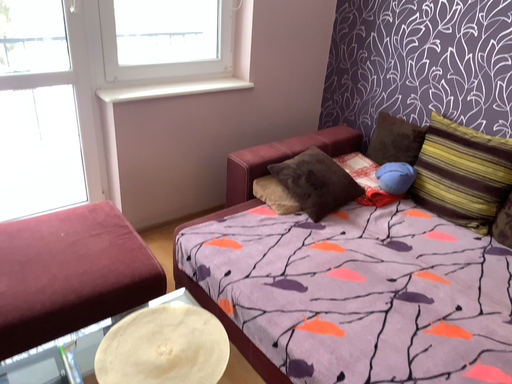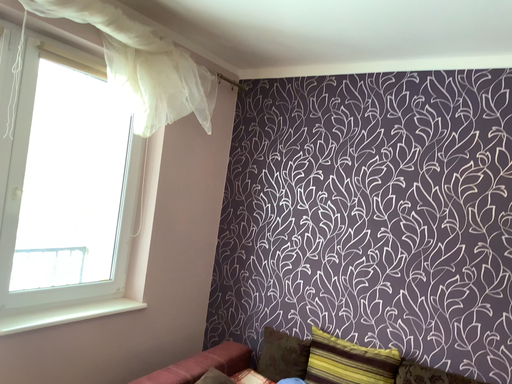
Question: Which way did the camera rotate in the video?

Choices:
 (A) rotated right
 (B) rotated left

Answer: (A)